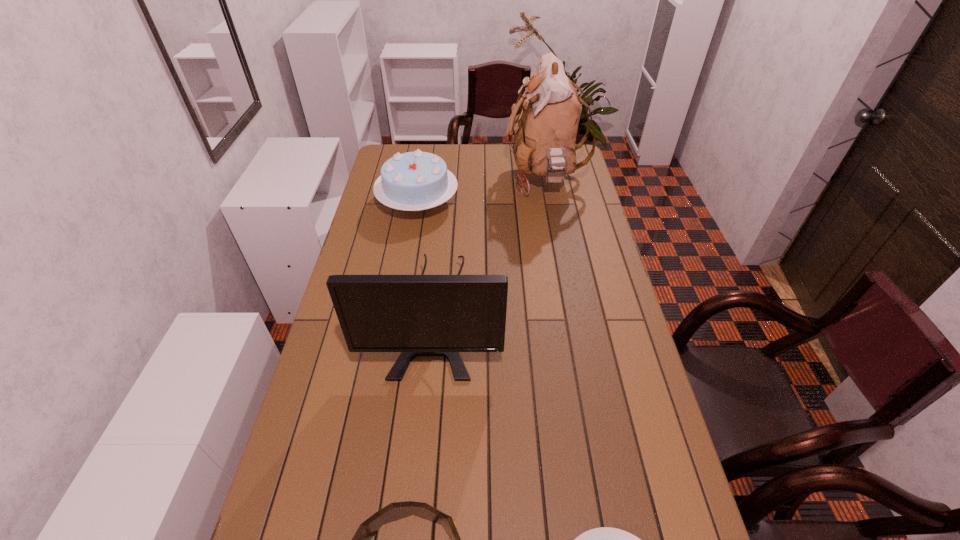
This screenshot has height=540, width=960. I want to click on backpack, so [545, 131].

Locate an element on the screen. The width and height of the screenshot is (960, 540). the third nearest object is located at coordinates (418, 315).

You are a GUI agent. You are given a task and a screenshot of the screen. Output one action in this format:
    pyautogui.click(x=<x>, y=<y>)
    Task: Click on the computer monitor
    
    Given the screenshot: What is the action you would take?
    pyautogui.click(x=418, y=315)

I want to click on birthday cake, so click(x=414, y=181).

This screenshot has width=960, height=540. In order to click on free spot located 0.330m on the front-facing side of the backpack in this screenshot , I will do click(x=427, y=178).

At what (x,y) coordinates should I click in order to perform the action: click on vacant space situated on the front-facing side of the backpack. Please return your answer as a coordinate pair (x, y). Looking at the image, I should click on (483, 178).

This screenshot has height=540, width=960. Identify the location of vacant space located on the front-facing side of the backpack. (455, 178).

Locate an element on the screen. This screenshot has height=540, width=960. free location located 0.290m on the screen side of the second tallest object is located at coordinates (418, 494).

I want to click on vacant region located on the front of the birthday cake, so click(x=408, y=263).

Locate an element on the screen. Image resolution: width=960 pixels, height=540 pixels. object located in the far edge section of the desktop is located at coordinates (545, 131).